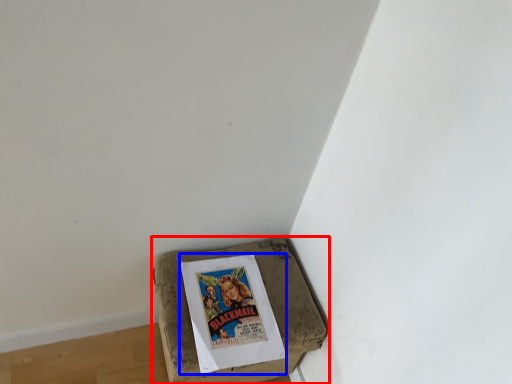
Question: Which of the following is the farthest to the observer, furniture (highlighted by a red box) or comic book (highlighted by a blue box)?

Choices:
 (A) furniture
 (B) comic book

Answer: (B)